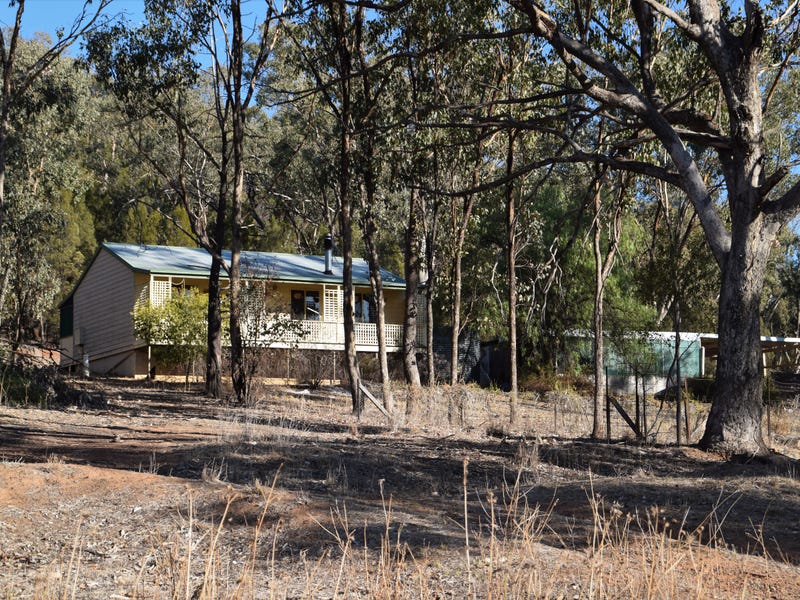
The width and height of the screenshot is (800, 600). Identify the location of chimney. (324, 262).